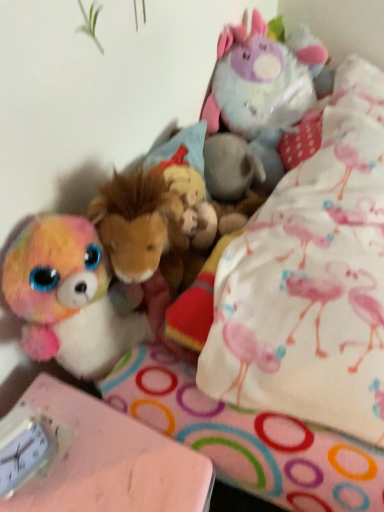
From the picture: Measure the distance between pink matte table at lower left and camera.

pink matte table at lower left is 23.54 inches away from camera.

Where is `pink matte table at lower left`? pink matte table at lower left is located at coordinates point(107,460).

Is white plastic clock at lower left a part of pink matte table at lower left?

No, white plastic clock at lower left is not inside pink matte table at lower left.

Considering the relative sizes of pink matte table at lower left and white plastic clock at lower left in the image provided, is pink matte table at lower left thinner than white plastic clock at lower left?

No, pink matte table at lower left is not thinner than white plastic clock at lower left.

Which is behind, point (118, 452) or point (23, 434)?

The point (118, 452) is behind.

Based on the photo, is white plastic clock at lower left beside fluffy plush unicorn at upper right?

No.

Is white plastic clock at lower left positioned in front of fluffy plush unicorn at upper right?

Yes, white plastic clock at lower left is closer to the viewer.

Does white plastic clock at lower left have a lesser width compared to fluffy plush unicorn at upper right?

Indeed, white plastic clock at lower left has a lesser width compared to fluffy plush unicorn at upper right.

Locate an element on the screen. toy above the pink matte table at lower left (from a real-world perspective) is located at coordinates (262, 80).

Is pink matte table at lower left surrounding fluffy plush unicorn at upper right?

Actually, fluffy plush unicorn at upper right is outside pink matte table at lower left.

From the image's perspective, is pink matte table at lower left under fluffy plush unicorn at upper right?

Correct, pink matte table at lower left appears lower than fluffy plush unicorn at upper right in the image.

Which of these two, white plastic clock at lower left or pink matte table at lower left, stands shorter?

white plastic clock at lower left is shorter.

Is white plastic clock at lower left smaller than pink matte table at lower left?

Yes.

Is pink matte table at lower left a part of white plastic clock at lower left?

No, pink matte table at lower left is located outside of white plastic clock at lower left.

From a real-world perspective, which is physically below, white plastic clock at lower left or pink matte table at lower left?

pink matte table at lower left is physically lower.

Considering the relative sizes of fluffy plush unicorn at upper right and white plastic clock at lower left in the image provided, is fluffy plush unicorn at upper right shorter than white plastic clock at lower left?

No, fluffy plush unicorn at upper right is not shorter than white plastic clock at lower left.

From the image's perspective, is fluffy plush unicorn at upper right located beneath white plastic clock at lower left?

No.

Is fluffy plush unicorn at upper right far from white plastic clock at lower left?

No, fluffy plush unicorn at upper right is not far from white plastic clock at lower left.

Is fluffy plush unicorn at upper right bigger than white plastic clock at lower left?

Yes, fluffy plush unicorn at upper right is bigger than white plastic clock at lower left.

Considering the relative sizes of fluffy plush unicorn at upper right and pink matte table at lower left in the image provided, is fluffy plush unicorn at upper right wider than pink matte table at lower left?

No, fluffy plush unicorn at upper right is not wider than pink matte table at lower left.

Is fluffy plush unicorn at upper right with pink matte table at lower left?

They are not placed beside each other.

How many degrees apart are the facing directions of fluffy plush unicorn at upper right and pink matte table at lower left?

The angular difference between fluffy plush unicorn at upper right and pink matte table at lower left is 4.5 degrees.

Is fluffy plush unicorn at upper right facing away from pink matte table at lower left?

No, fluffy plush unicorn at upper right is not facing the opposite direction of pink matte table at lower left.

At what (x,y) coordinates should I click in order to perform the action: click on clock on the left side of pink matte table at lower left. Please return your answer as a coordinate pair (x, y). Looking at the image, I should click on (23, 458).

Where is `toy on the right of white plastic clock at lower left`? The height and width of the screenshot is (512, 384). toy on the right of white plastic clock at lower left is located at coordinates (262, 80).

Based on their spatial positions, is white plastic clock at lower left or fluffy plush unicorn at upper right further from pink matte table at lower left?

fluffy plush unicorn at upper right.

When comparing their distances from fluffy plush unicorn at upper right, does pink matte table at lower left or white plastic clock at lower left seem closer?

pink matte table at lower left.

Considering their positions, is pink matte table at lower left positioned further to white plastic clock at lower left than fluffy plush unicorn at upper right?

Among the two, fluffy plush unicorn at upper right is located further to white plastic clock at lower left.

Based on their spatial positions, is fluffy plush unicorn at upper right or white plastic clock at lower left closer to pink matte table at lower left?

white plastic clock at lower left is positioned closer to the anchor pink matte table at lower left.

Estimate the real-world distances between objects in this image. Which object is further from fluffy plush unicorn at upper right, white plastic clock at lower left or pink matte table at lower left?

The object further to fluffy plush unicorn at upper right is white plastic clock at lower left.

Estimate the real-world distances between objects in this image. Which object is further from white plastic clock at lower left, fluffy plush unicorn at upper right or pink matte table at lower left?

Based on the image, fluffy plush unicorn at upper right appears to be further to white plastic clock at lower left.

The height and width of the screenshot is (512, 384). Find the location of `clock between fluffy plush unicorn at upper right and pink matte table at lower left in the up-down direction`. clock between fluffy plush unicorn at upper right and pink matte table at lower left in the up-down direction is located at coordinates (23, 458).